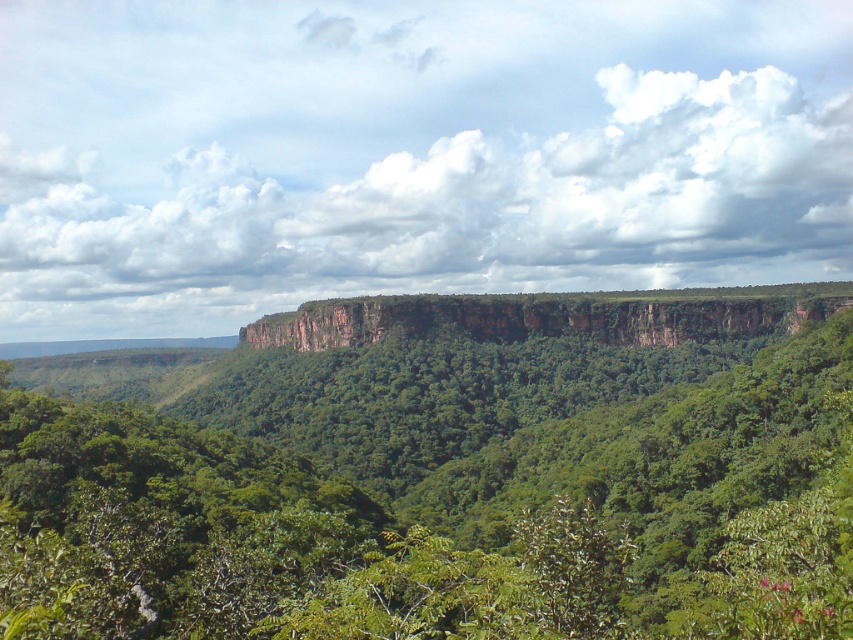
You are standing at the origin point in the image and want to reach the green leafy tree at center. Which direction should you move to get there?

The green leafy tree at center is located at point 0.764 on the x and 0.492 on the y. Since you are at the origin, you should move towards the right and slightly upwards to reach it.

You are a hiker standing at the edge of the forest looking towards the middle of the image. You see a green leafy tree at center and a brown rocky cliff at center. Which object is located to the right side?

The brown rocky cliff at center is located to the right side of the green leafy tree at center.

You are standing in the lush landscape and want to take a photo of the green leafy tree at center and the brown rocky cliff at center. Which object will appear larger in the photo?

The green leafy tree at center will appear larger in the photo because it is closer to you than the brown rocky cliff at center.